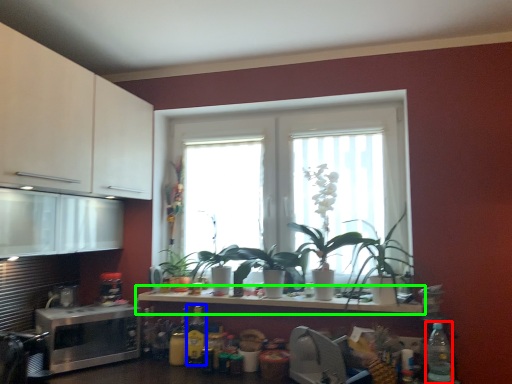
Question: Which is farther away from bottle (highlighted by a red box)? bottle (highlighted by a blue box) or countertop (highlighted by a green box)?

Choices:
 (A) bottle
 (B) countertop

Answer: (A)